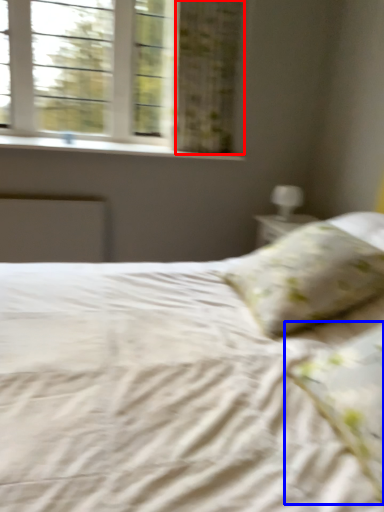
Question: Which object appears farthest to the camera in this image, curtain (highlighted by a red box) or pillow (highlighted by a blue box)?

Choices:
 (A) curtain
 (B) pillow

Answer: (A)